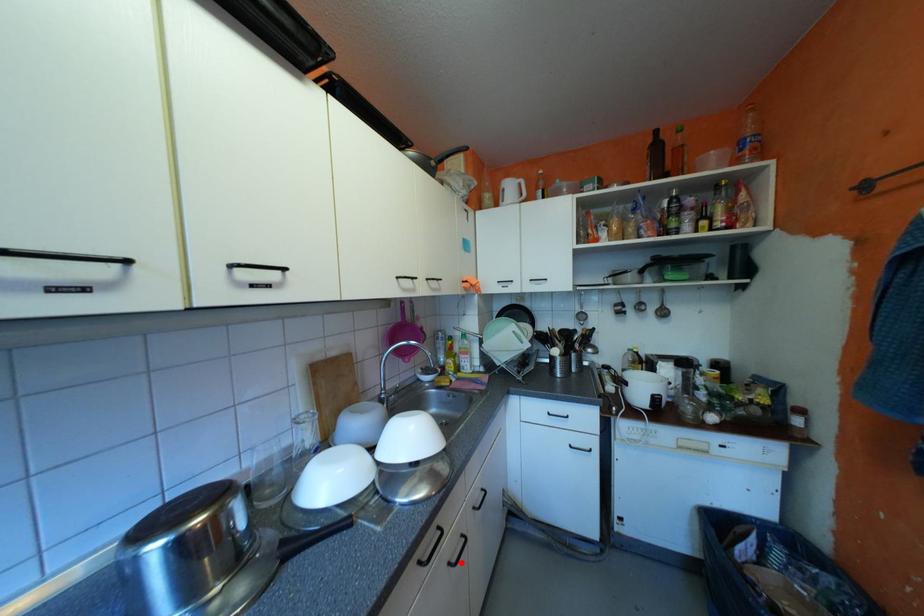
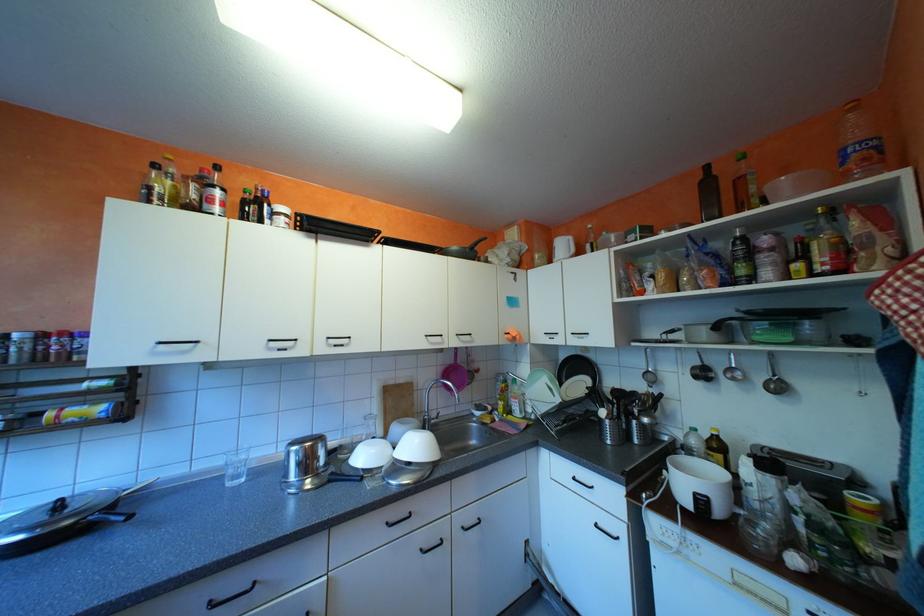
Where in the second image is the point corresponding to the highlighted location from the first image?

(432, 549)